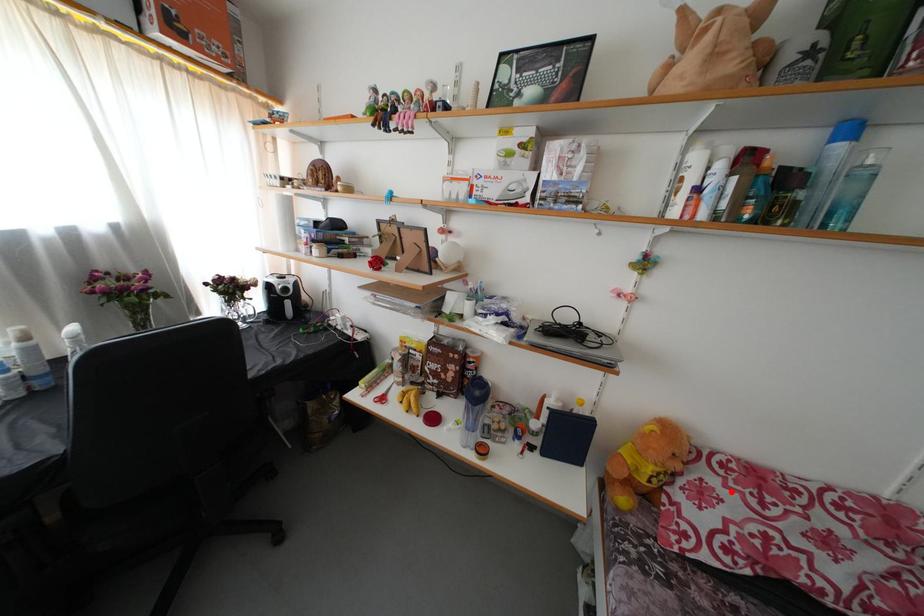
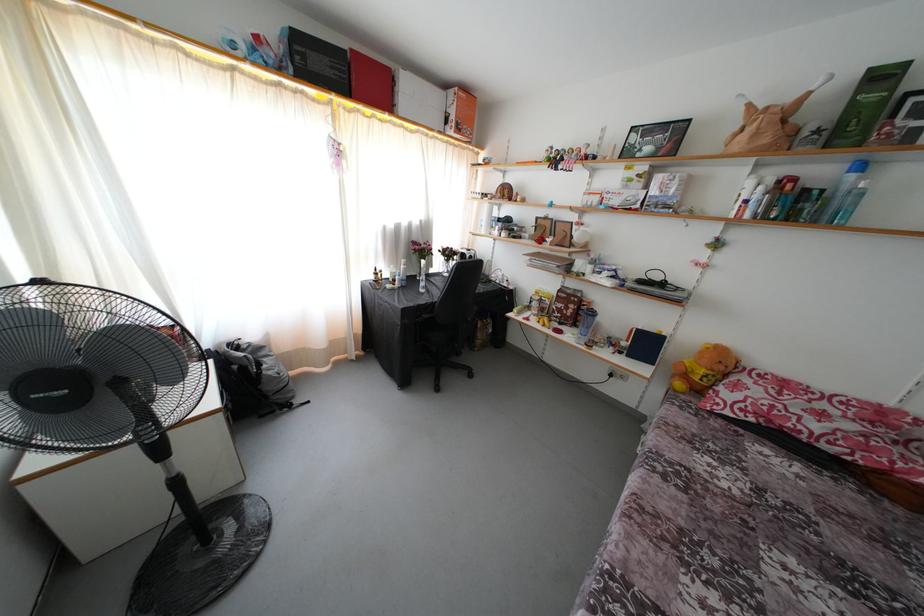
Where in the second image is the point corresponding to the highlighted location from the first image?

(760, 389)